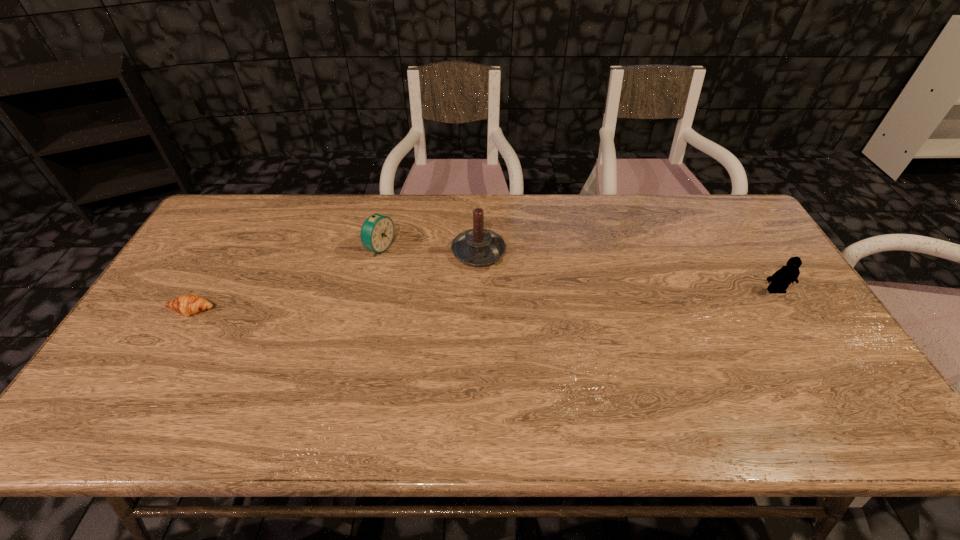
You are a GUI agent. You are given a task and a screenshot of the screen. Output one action in this format:
    pyautogui.click(x=<x>, y=<y>)
    Task: Click on the free region at the near edge of the desktop
    
    Given the screenshot: What is the action you would take?
    pyautogui.click(x=269, y=393)

Image resolution: width=960 pixels, height=540 pixels. I want to click on vacant space at the left edge, so click(185, 261).

This screenshot has height=540, width=960. I want to click on vacant space at the far left corner of the desktop, so click(244, 206).

Find the location of a particular element. free region at the far right corner of the desktop is located at coordinates (711, 200).

This screenshot has height=540, width=960. Identify the location of free space at the near right corner of the desktop. (859, 397).

Locate an element on the screen. This screenshot has height=540, width=960. vacant area between the candle and the rightmost object is located at coordinates (627, 271).

Find the location of a particular element. Image resolution: width=960 pixels, height=540 pixels. vacant area between the second object from left to right and the tallest object is located at coordinates pos(429,250).

Image resolution: width=960 pixels, height=540 pixels. In order to click on vacant area that lies between the tallest object and the shortest object in this screenshot , I will do `click(336, 281)`.

You are a GUI agent. You are given a task and a screenshot of the screen. Output one action in this format:
    pyautogui.click(x=<x>, y=<y>)
    Task: Click on the free spot between the Lego and the alarm clock
    The width and height of the screenshot is (960, 540).
    Given the screenshot: What is the action you would take?
    pyautogui.click(x=578, y=269)

This screenshot has height=540, width=960. What are the coordinates of `free space between the third object from right to left and the nearest object` in the screenshot? It's located at [286, 279].